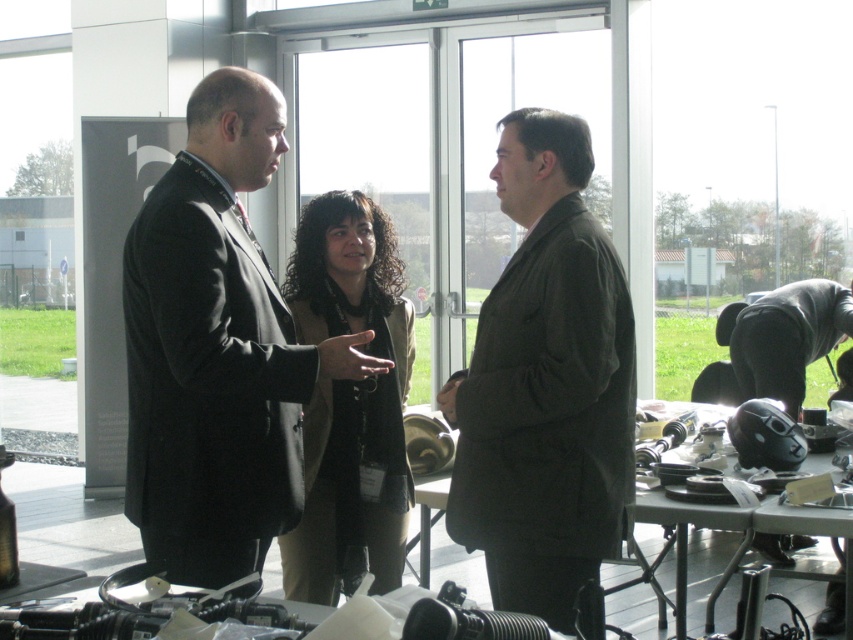
Does matte black suit at center have a greater width compared to dark brown suit at center?

Yes, matte black suit at center is wider than dark brown suit at center.

How much distance is there between matte black suit at center and dark brown suit at center?

matte black suit at center is 20.87 inches from dark brown suit at center.

What do you see at coordinates (218, 349) in the screenshot? The image size is (853, 640). I see `matte black suit at center` at bounding box center [218, 349].

Identify the location of matte black suit at center. (218, 349).

Is dark brown suit at center smaller than black matte helmet at right?

Yes, dark brown suit at center is smaller than black matte helmet at right.

Does dark brown suit at center lie in front of black matte helmet at right?

That is True.

Who is more distant from viewer, (521, 448) or (775, 540)?

The point (775, 540) is more distant.

Locate an element on the screen. This screenshot has height=640, width=853. dark brown suit at center is located at coordinates (544, 385).

Between point (225, 449) and point (381, 339), which one is positioned in front?

Positioned in front is point (225, 449).

Where is `matte black suit at center`? The height and width of the screenshot is (640, 853). matte black suit at center is located at coordinates (218, 349).